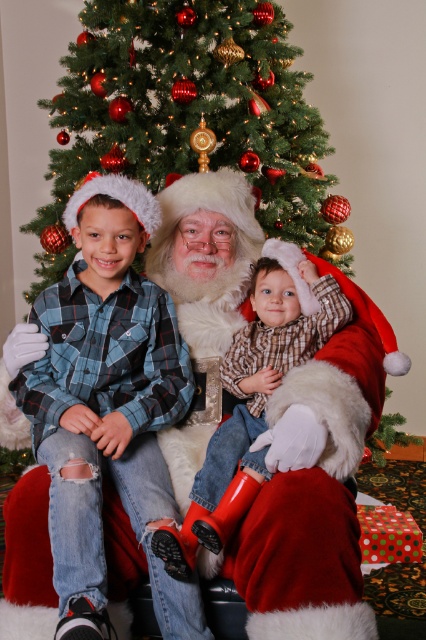
Question: Is blue plaid shirt at center thinner than plaid flannel shirt at center?

Choices:
 (A) yes
 (B) no

Answer: (B)

Question: Is green textured christmas tree at upper center smaller than plaid flannel shirt at center?

Choices:
 (A) yes
 (B) no

Answer: (B)

Question: Which object is the farthest from the blue plaid shirt at center?

Choices:
 (A) green textured christmas tree at upper center
 (B) plaid flannel shirt at center

Answer: (A)

Question: Is green textured christmas tree at upper center positioned behind plaid flannel shirt at center?

Choices:
 (A) no
 (B) yes

Answer: (B)

Question: Estimate the real-world distances between objects in this image. Which object is closer to the plaid flannel shirt at center?

Choices:
 (A) blue plaid shirt at center
 (B) green textured christmas tree at upper center

Answer: (A)

Question: Which object appears farthest from the camera in this image?

Choices:
 (A) blue plaid shirt at center
 (B) green textured christmas tree at upper center
 (C) plaid flannel shirt at center

Answer: (B)